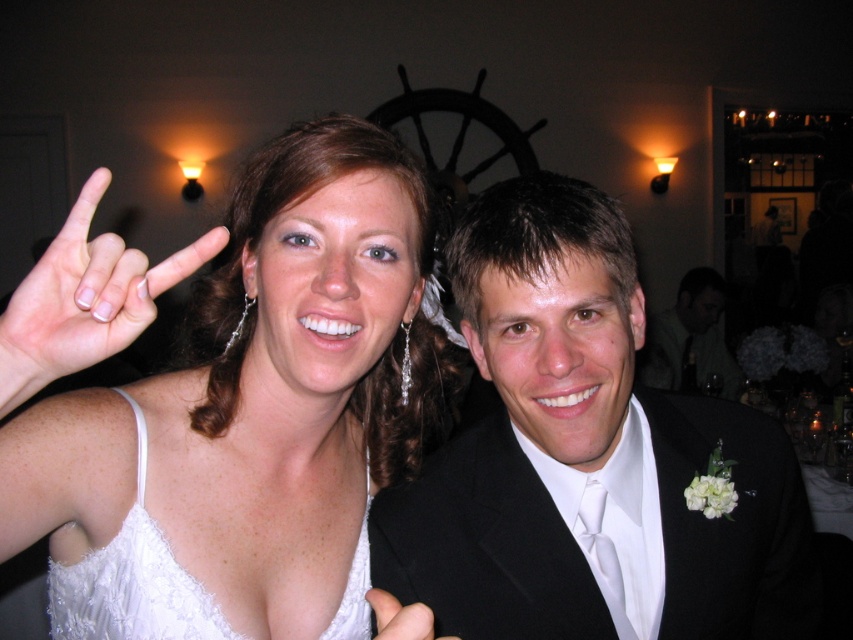
Question: Does white matte hand at upper left have a smaller size compared to white satin hand at center?

Choices:
 (A) no
 (B) yes

Answer: (A)

Question: Which object is farther from the camera taking this photo?

Choices:
 (A) white lace dress at center
 (B) white satin dress at upper left
 (C) black satin suit at center
 (D) white satin hand at center

Answer: (A)

Question: Does white satin dress at upper left appear under white satin hand at center?

Choices:
 (A) no
 (B) yes

Answer: (A)

Question: Which point is closer to the camera?

Choices:
 (A) (111, 333)
 (B) (397, 620)

Answer: (B)

Question: Estimate the real-world distances between objects in this image. Which object is closer to the white satin dress at upper left?

Choices:
 (A) white matte hand at upper left
 (B) white satin hand at center
 (C) black satin suit at center

Answer: (A)

Question: Does white satin dress at upper left appear under white satin hand at center?

Choices:
 (A) no
 (B) yes

Answer: (A)